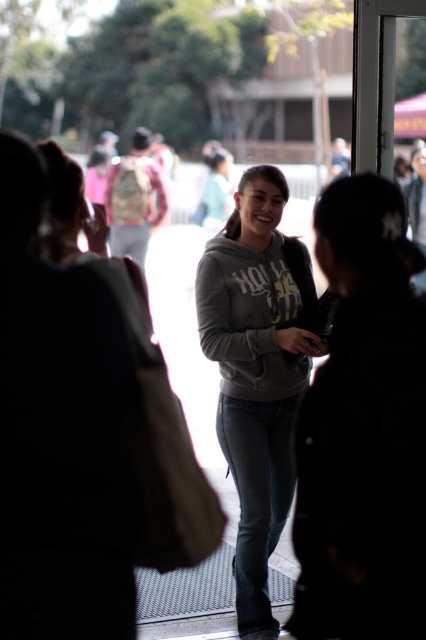
Can you confirm if gray matte hoodie at center is positioned above gray fleece sweatshirt at center?

No, gray matte hoodie at center is not above gray fleece sweatshirt at center.

Looking at this image, can you confirm if gray matte hoodie at center is smaller than gray fleece sweatshirt at center?

No.

Is point (256, 518) closer to camera compared to point (304, 273)?

Yes, it is in front of point (304, 273).

The image size is (426, 640). Find the location of `gray matte hoodie at center`. gray matte hoodie at center is located at coordinates (258, 371).